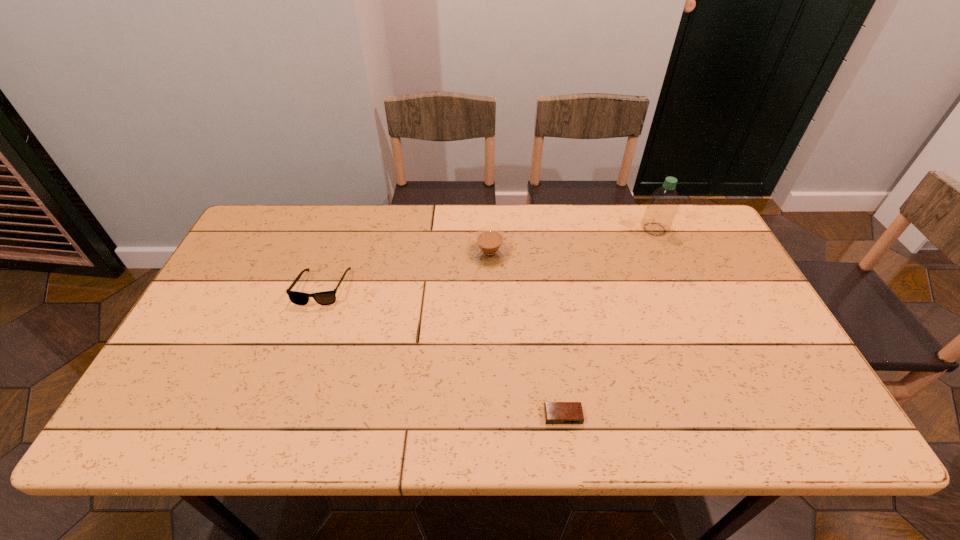
What are the coordinates of `vacant point located 0.060m on the front-facing side of the leftmost object` in the screenshot? It's located at (309, 325).

Where is `water bottle present at the far edge`? Image resolution: width=960 pixels, height=540 pixels. water bottle present at the far edge is located at coordinates (663, 204).

The image size is (960, 540). Find the location of `cappuccino at the far edge`. cappuccino at the far edge is located at coordinates click(489, 248).

This screenshot has width=960, height=540. In order to click on object that is at the near edge in this screenshot , I will do `click(555, 412)`.

I want to click on object present at the right edge, so click(663, 204).

This screenshot has height=540, width=960. What are the coordinates of `object that is positioned at the far right corner` in the screenshot? It's located at (663, 204).

In the image, there is a desktop. Where is `vacant area at the far edge`? This screenshot has width=960, height=540. vacant area at the far edge is located at coordinates (481, 214).

This screenshot has width=960, height=540. Find the location of `free region at the near edge of the desktop`. free region at the near edge of the desktop is located at coordinates (220, 416).

In the image, there is a desktop. Identify the location of vacant space at the left edge. The width and height of the screenshot is (960, 540). (250, 327).

The height and width of the screenshot is (540, 960). I want to click on vacant space at the right edge, so click(x=729, y=288).